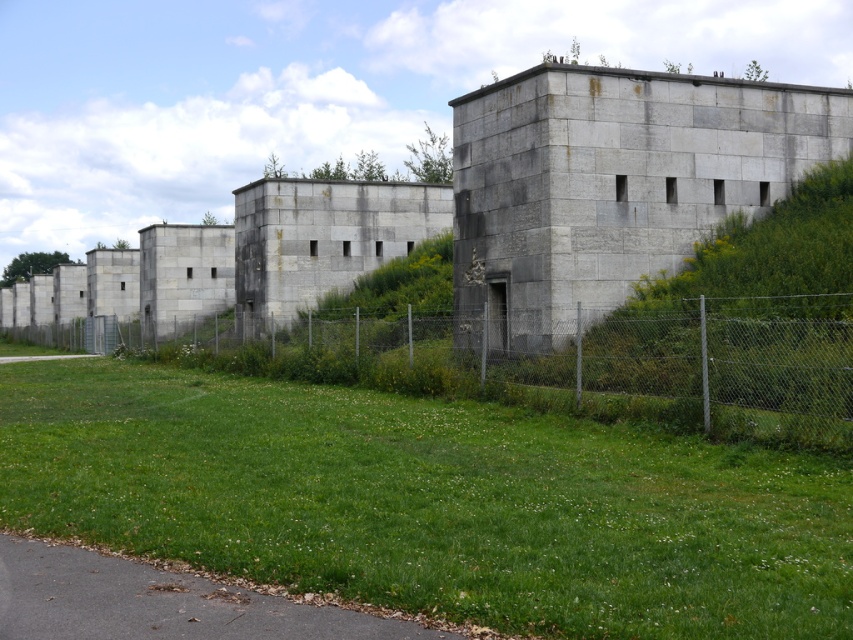
Can you confirm if gray concrete building at center is positioned above metal chain-link fence at center?

Indeed, gray concrete building at center is positioned over metal chain-link fence at center.

Who is lower down, gray concrete building at center or metal chain-link fence at center?

metal chain-link fence at center is lower down.

Which is behind, point (471, 243) or point (805, 371)?

The point (471, 243) is behind.

The width and height of the screenshot is (853, 640). I want to click on gray concrete building at center, so coord(492,205).

Which is behind, point (682, 632) or point (614, 211)?

The point (614, 211) is more distant.

Can you confirm if green grass at lower center is positioned to the left of gray concrete building at center?

Incorrect, green grass at lower center is not on the left side of gray concrete building at center.

This screenshot has width=853, height=640. In order to click on green grass at lower center in this screenshot , I will do `click(431, 500)`.

Is point (680, 538) behind point (808, 340)?

No, (680, 538) is in front of (808, 340).

Is green grass at lower center closer to camera compared to metal chain-link fence at center?

Yes.

This screenshot has width=853, height=640. What are the coordinates of `green grass at lower center` in the screenshot? It's located at (431, 500).